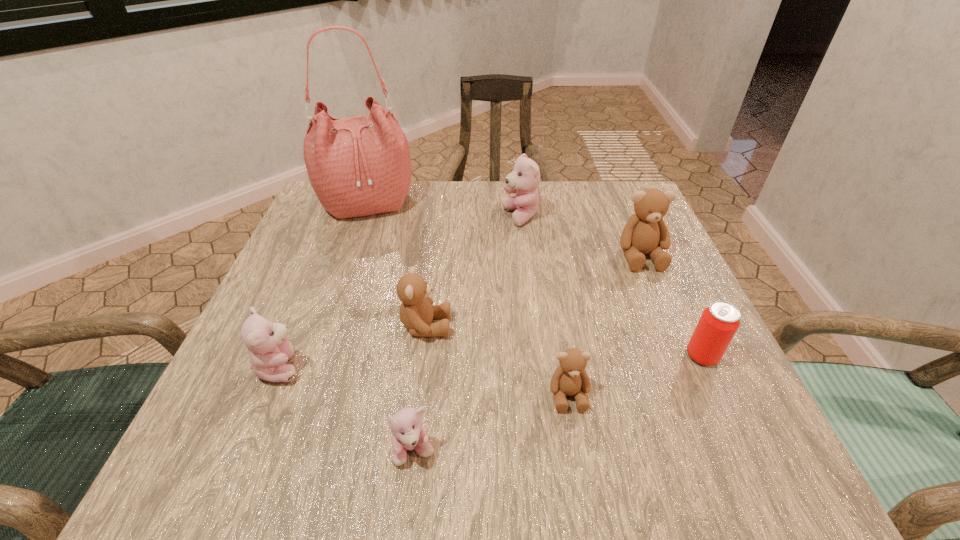
I want to click on pink teddy bear that is the second closest to the third farthest teddy bear, so click(x=408, y=433).

The image size is (960, 540). In order to click on pink teddy bear that stands as the third closest to the second biggest brown teddy bear in this screenshot , I will do `click(524, 180)`.

Locate which brown teddy bear is the closest to the nearest brown teddy bear. Please provide its 2D coordinates. Your answer should be formatted as a tuple, i.e. [(x, y)], where the tuple contains the x and y coordinates of a point satisfying the conditions above.

[(416, 311)]

Point out which brown teddy bear is positioned as the nearest to the second nearest brown teddy bear. Please provide its 2D coordinates. Your answer should be formatted as a tuple, i.e. [(x, y)], where the tuple contains the x and y coordinates of a point satisfying the conditions above.

[(570, 378)]

At what (x,y) coordinates should I click in order to perform the action: click on free point that satisfies the following two spatial constraints: 1. on the face of the beer can; 2. on the left side of the rightmost teddy bear. Please return your answer as a coordinate pair (x, y). Image resolution: width=960 pixels, height=540 pixels. Looking at the image, I should click on (684, 356).

Locate an element on the screen. The image size is (960, 540). free location that satisfies the following two spatial constraints: 1. on the face of the farthest brown teddy bear; 2. at the face of the leftmost pink teddy bear is located at coordinates (687, 367).

Where is `vacant area that satisfies the following two spatial constraints: 1. at the face of the farthest pink teddy bear; 2. at the face of the nearest teddy bear`? The width and height of the screenshot is (960, 540). vacant area that satisfies the following two spatial constraints: 1. at the face of the farthest pink teddy bear; 2. at the face of the nearest teddy bear is located at coordinates (548, 450).

Locate an element on the screen. The height and width of the screenshot is (540, 960). blank space that satisfies the following two spatial constraints: 1. on the face of the biggest brown teddy bear; 2. on the face of the leftmost brown teddy bear is located at coordinates (670, 326).